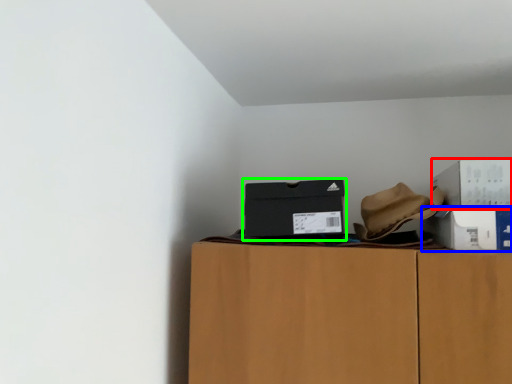
Question: Which is farther away from box (highlighted by a red box)? box (highlighted by a blue box) or box (highlighted by a green box)?

Choices:
 (A) box
 (B) box

Answer: (B)